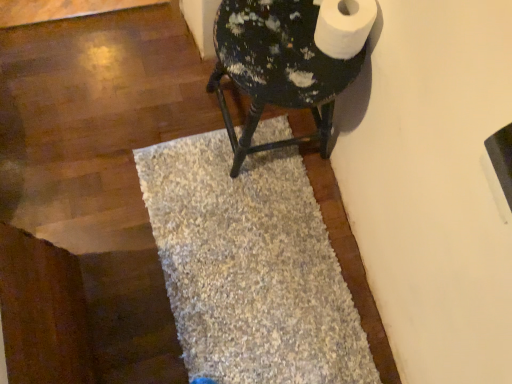
Where is `vacant space underneath beige shaggy bath mat at center (from a real-world perspective)`? vacant space underneath beige shaggy bath mat at center (from a real-world perspective) is located at coordinates (278, 325).